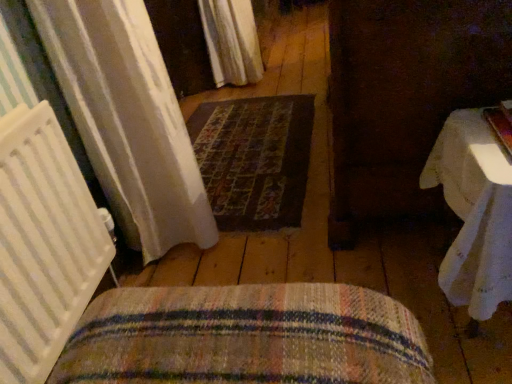
Where is `vacant point above woven fabric cushion at lower center (from a real-world perspective)`? This screenshot has width=512, height=384. vacant point above woven fabric cushion at lower center (from a real-world perspective) is located at coordinates (252, 326).